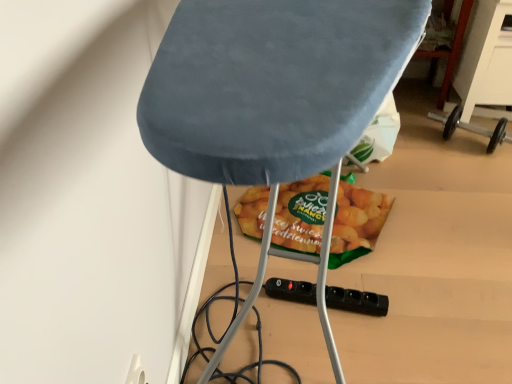
Locate an element on the screen. The height and width of the screenshot is (384, 512). vacant area that lies between black plastic socket at lower center and green matte snack at center is located at coordinates (332, 274).